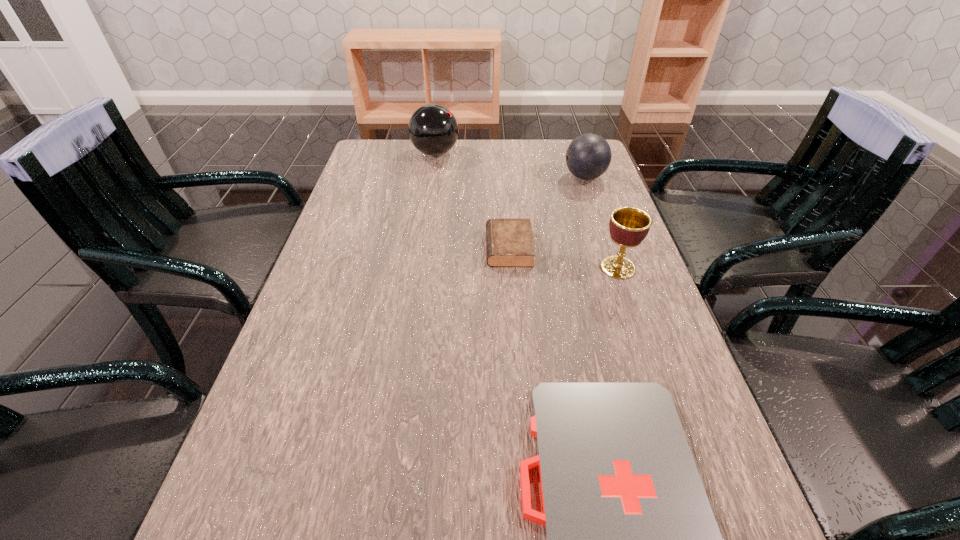
Locate an element on the screen. Image resolution: width=960 pixels, height=540 pixels. the left bowling ball is located at coordinates (433, 129).

Where is `the farthest object`? The height and width of the screenshot is (540, 960). the farthest object is located at coordinates (433, 129).

You are a GUI agent. You are given a task and a screenshot of the screen. Output one action in this format:
    pyautogui.click(x=<x>, y=<y>)
    Task: Click on the chalice
    The width and height of the screenshot is (960, 540).
    Given the screenshot: What is the action you would take?
    pyautogui.click(x=628, y=226)

Identify the location of the nearer bowling ball. click(588, 156).

I want to click on the shorter bowling ball, so tap(588, 156).

Locate an element on the screen. This screenshot has height=540, width=960. diary is located at coordinates (509, 242).

Locate an element on the screen. This screenshot has height=540, width=960. vacant position located 0.050m on the surface of the leftmost object near the finger holes is located at coordinates (474, 153).

Locate an element on the screen. The width and height of the screenshot is (960, 540). free location located 0.230m on the back of the chalice is located at coordinates (595, 202).

Locate an element on the screen. vacant space located 0.270m on the grip area of the nearer bowling ball is located at coordinates (474, 177).

At what (x,y) coordinates should I click in order to perform the action: click on free region located on the grip area of the nearer bowling ball. Please return your answer as a coordinate pair (x, y). Looking at the image, I should click on (487, 177).